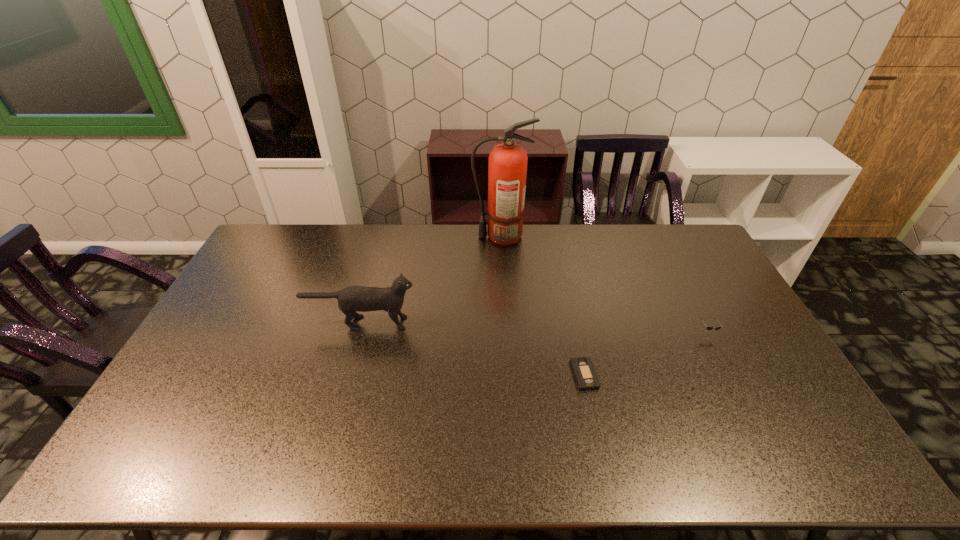
The image size is (960, 540). I want to click on vacant region located 0.290m on the nozzle of the farthest object, so click(398, 237).

Locate an element on the screen. vacant space positioned on the front-facing side of the cat is located at coordinates (478, 323).

The width and height of the screenshot is (960, 540). Find the location of `vacant region located in front of the lenses of the sunglasses`. vacant region located in front of the lenses of the sunglasses is located at coordinates click(718, 353).

Find the location of a particular element. The height and width of the screenshot is (540, 960). vacant space situated on the front of the second object from right to left is located at coordinates (602, 455).

Identify the location of object situated at the far edge. pos(507,164).

Find the location of a particular element. Image resolution: width=960 pixels, height=540 pixels. object that is at the right edge is located at coordinates (708, 327).

Image resolution: width=960 pixels, height=540 pixels. Identify the location of free space at the far edge of the desktop. (361, 243).

I want to click on vacant area at the near edge, so (x=357, y=472).

The width and height of the screenshot is (960, 540). In order to click on vacant space at the left edge of the desktop in this screenshot , I will do `click(214, 415)`.

At what (x,y) coordinates should I click in order to perform the action: click on free point at the right edge. Please return your answer as a coordinate pair (x, y). Looking at the image, I should click on (734, 315).